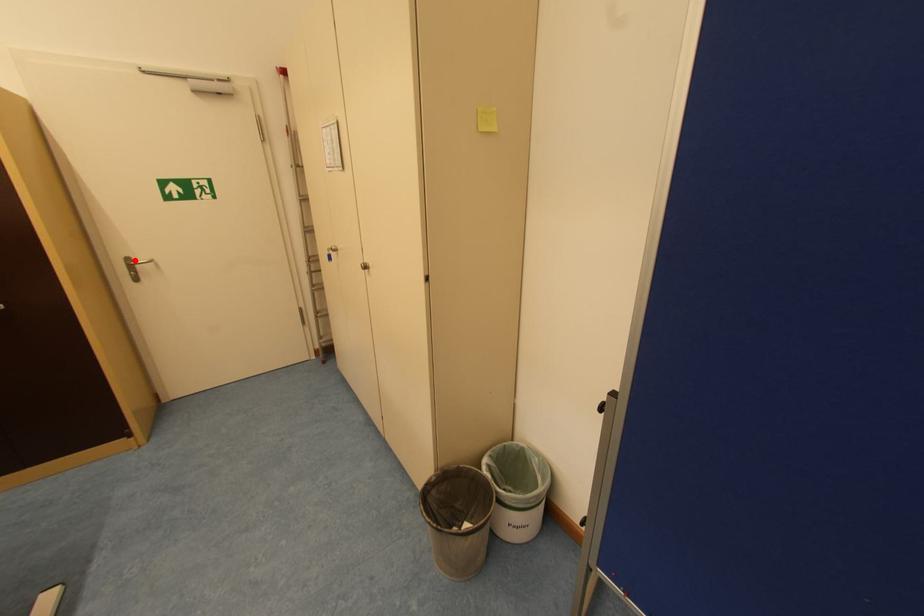
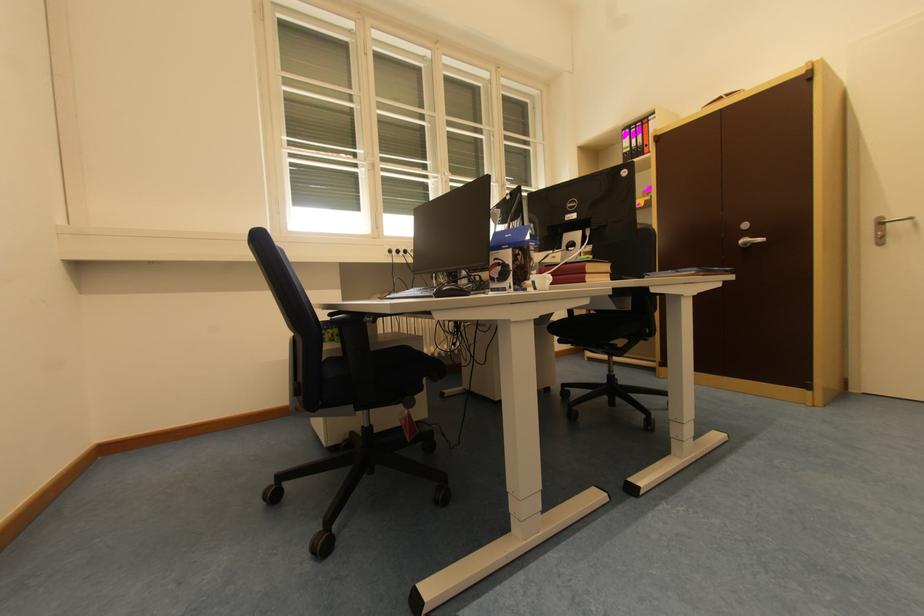
Question: A red point is marked in image1. In image2, is the corresponding 3D point closer to the camera or farther? Reply with the corresponding letter.

Choices:
 (A) The corresponding 3D point is closer.
 (B) The corresponding 3D point is farther.

Answer: (B)